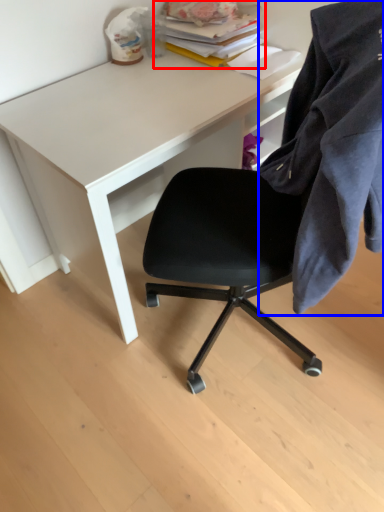
Question: Among these objects, which one is farthest to the camera, book (highlighted by a red box) or cloth (highlighted by a blue box)?

Choices:
 (A) book
 (B) cloth

Answer: (A)